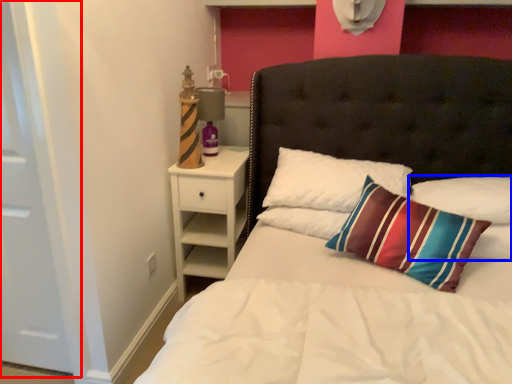
Question: Among these objects, which one is farthest to the camera, door (highlighted by a red box) or pillow (highlighted by a blue box)?

Choices:
 (A) door
 (B) pillow

Answer: (B)